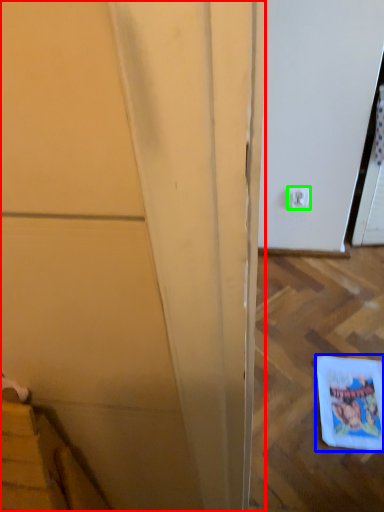
Question: Which object is the farthest from door (highlighted by a red box)? Choose among these: comic book (highlighted by a blue box) or electric outlet (highlighted by a green box).

Choices:
 (A) comic book
 (B) electric outlet

Answer: (B)